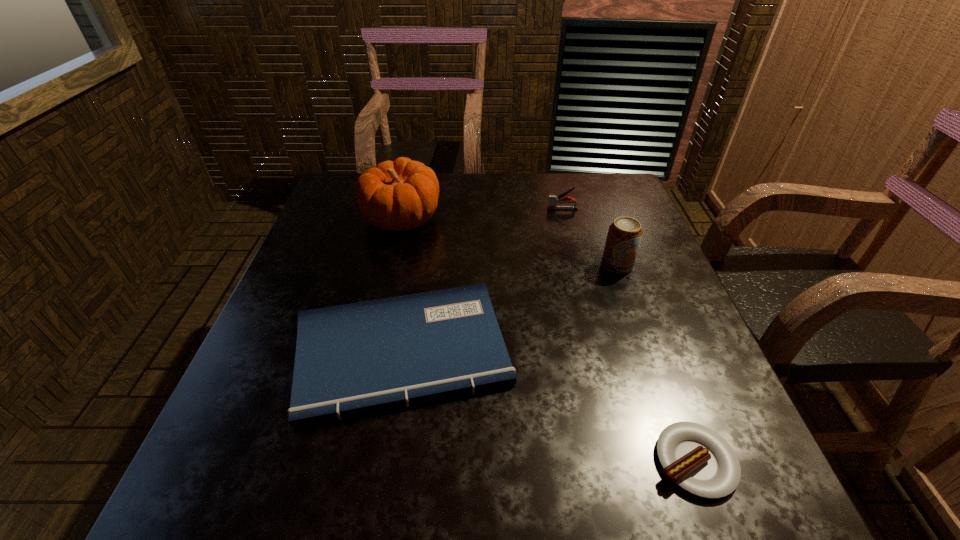
At what (x,y) coordinates should I click in order to perform the action: click on vacant area between the tallest object and the third object from left to right. Please return your answer as a coordinate pair (x, y). Looking at the image, I should click on (482, 214).

Where is `free space between the tallest object and the beer can`? free space between the tallest object and the beer can is located at coordinates (509, 242).

Where is `empty location between the paperback book and the stapler`? This screenshot has width=960, height=540. empty location between the paperback book and the stapler is located at coordinates (482, 281).

Identify the location of free space between the sausage and the beer can. (656, 363).

Locate an element on the screen. free space between the sausage and the third tallest object is located at coordinates (629, 335).

You are a GUI agent. You are given a task and a screenshot of the screen. Output one action in this format:
    pyautogui.click(x=<x>, y=<y>)
    Task: Click on the vacant area that lies between the sausage and the third object from right to left
    The height and width of the screenshot is (540, 960).
    Given the screenshot: What is the action you would take?
    pyautogui.click(x=629, y=335)

Locate an element on the screen. Image resolution: width=960 pixels, height=540 pixels. empty space between the sausage and the paperback book is located at coordinates (548, 407).

Image resolution: width=960 pixels, height=540 pixels. I want to click on free space between the beer can and the paperback book, so click(510, 309).

This screenshot has width=960, height=540. What are the coordinates of `the second closest object to the sausage` in the screenshot? It's located at (624, 235).

Identify which object is the fourth closest to the paperback book. Please provide its 2D coordinates. Your answer should be formatted as a tuple, i.e. [(x, y)], where the tuple contains the x and y coordinates of a point satisfying the conditions above.

[(553, 200)]